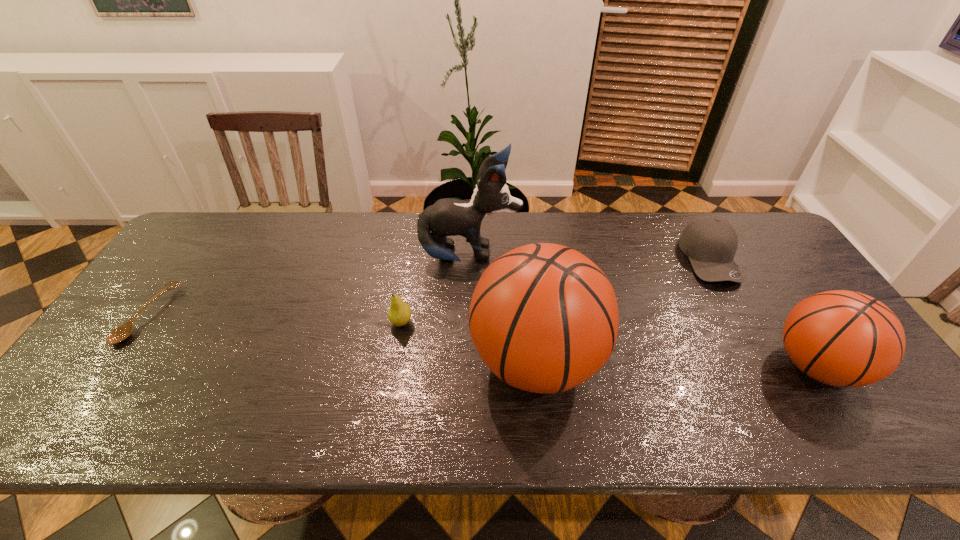
Where is `free point that keeps the basketballs evenly spaced on the left`? Image resolution: width=960 pixels, height=540 pixels. free point that keeps the basketballs evenly spaced on the left is located at coordinates (262, 357).